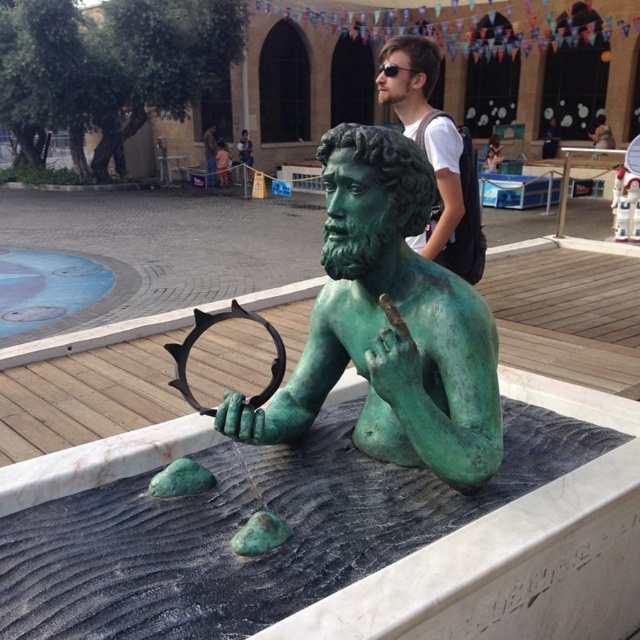
Based on the coordinates provided, which object is located at point (388, 324)?

The point (388, 324) indicates the green patina bronze statue at center.

You are an art student standing in front of the green patina bronze statue at center and the matte green statue at upper center. Which statue is closer to you?

The green patina bronze statue at center is closer to you since it is positioned in front of the matte green statue at upper center.